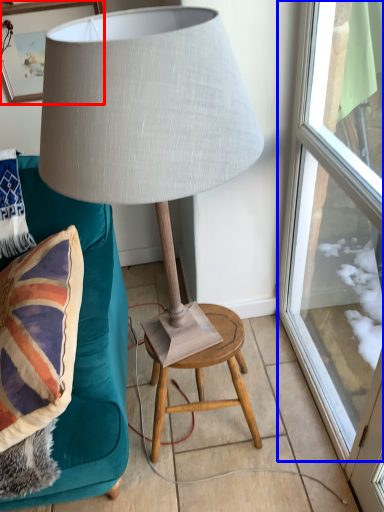
Question: Which object is further to the camera taking this photo, picture frame (highlighted by a red box) or window (highlighted by a blue box)?

Choices:
 (A) picture frame
 (B) window

Answer: (A)